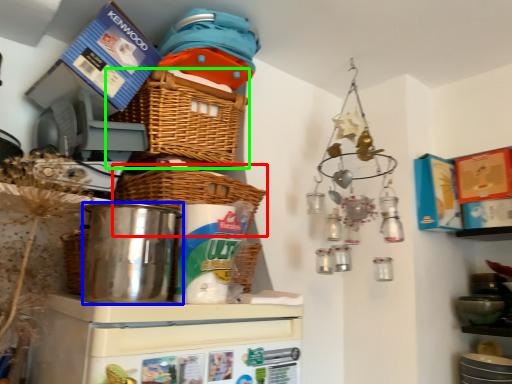
Question: Which is nearer to the basket (highlighted by a red box)? appliance (highlighted by a blue box) or basket (highlighted by a green box).

Choices:
 (A) appliance
 (B) basket

Answer: (A)